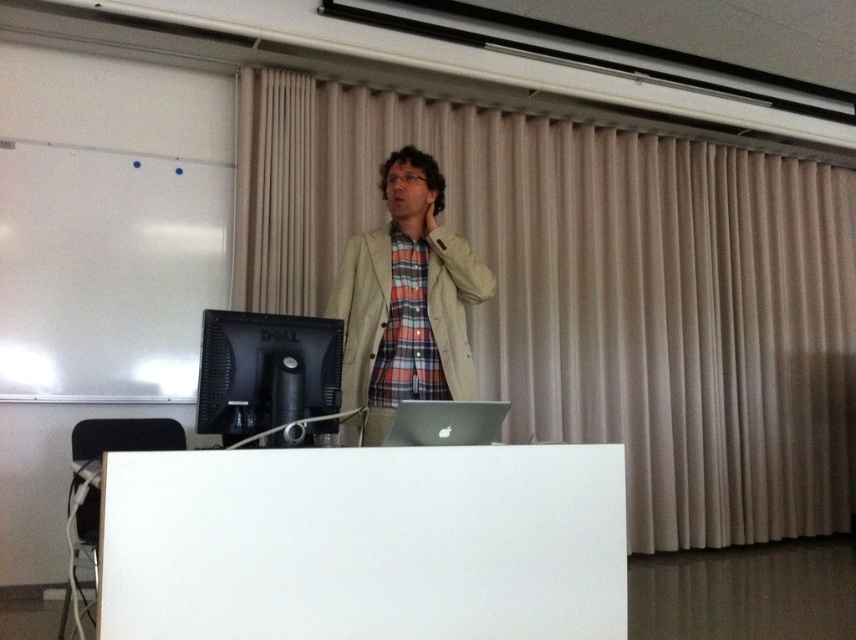
Consider the image. Who is higher up, white matte table at center or sleek silver laptop at center?

sleek silver laptop at center is higher up.

The image size is (856, 640). I want to click on white matte table at center, so click(364, 544).

Identify the location of white matte table at center. (364, 544).

Is beige fabric curtain at upper center shorter than light beige fabric jacket at center?

In fact, beige fabric curtain at upper center may be taller than light beige fabric jacket at center.

Is beige fabric curtain at upper center positioned at the back of light beige fabric jacket at center?

Yes, beige fabric curtain at upper center is behind light beige fabric jacket at center.

Is point (785, 406) positioned behind point (437, 301)?

Yes, point (785, 406) is behind point (437, 301).

Locate an element on the screen. beige fabric curtain at upper center is located at coordinates (599, 291).

Locate an element on the screen. Image resolution: width=856 pixels, height=640 pixels. beige fabric curtain at upper center is located at coordinates (599, 291).